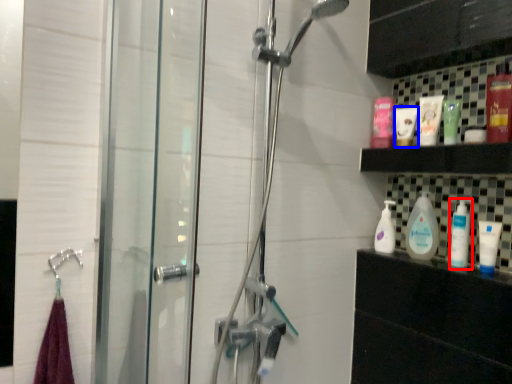
Question: Among these objects, which one is farthest to the camera, cleaning product (highlighted by a red box) or toiletry (highlighted by a blue box)?

Choices:
 (A) cleaning product
 (B) toiletry

Answer: (B)